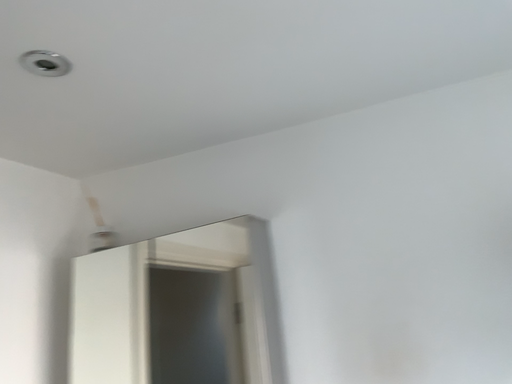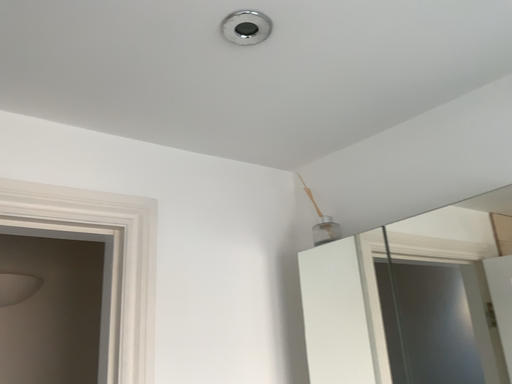
Question: How did the camera likely rotate when shooting the video?

Choices:
 (A) rotated left
 (B) rotated right

Answer: (A)